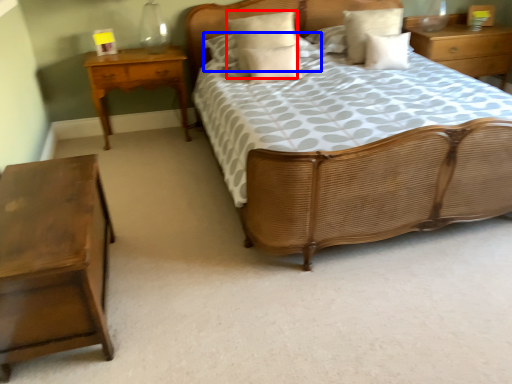
Question: Among these objects, which one is farthest to the camera, pillow (highlighted by a red box) or pillow (highlighted by a blue box)?

Choices:
 (A) pillow
 (B) pillow

Answer: (B)